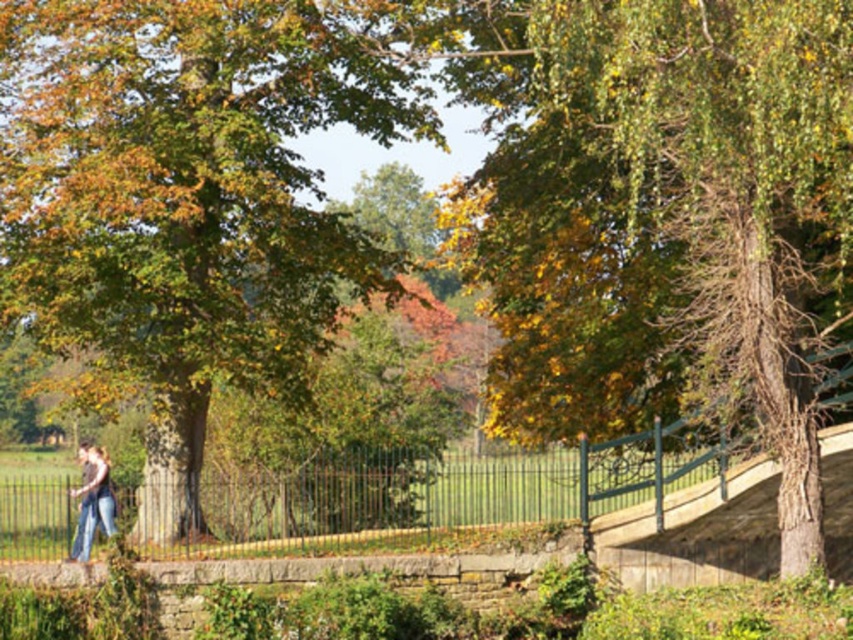
You are a bird looking for a place to perch. You see the green leafy tree at upper right and the green leafy tree at left. Which tree has a wider canopy to choose from?

The green leafy tree at left has a wider canopy than the green leafy tree at upper right.

You are standing in the park and want to take a photo of both the green leafy tree at upper right and the green leafy tree at left. Which tree should you position yourself closer to in order to capture both in the frame?

Since the green leafy tree at upper right is shorter than the green leafy tree at left, you should position yourself closer to the green leafy tree at upper right to ensure both trees are visible in the frame.